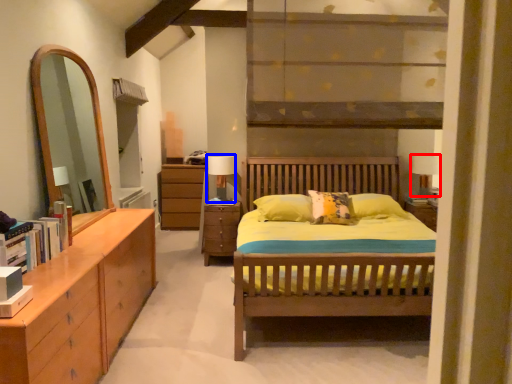
Question: Which object appears closest to the camera in this image, table lamp (highlighted by a red box) or table lamp (highlighted by a blue box)?

Choices:
 (A) table lamp
 (B) table lamp

Answer: (B)